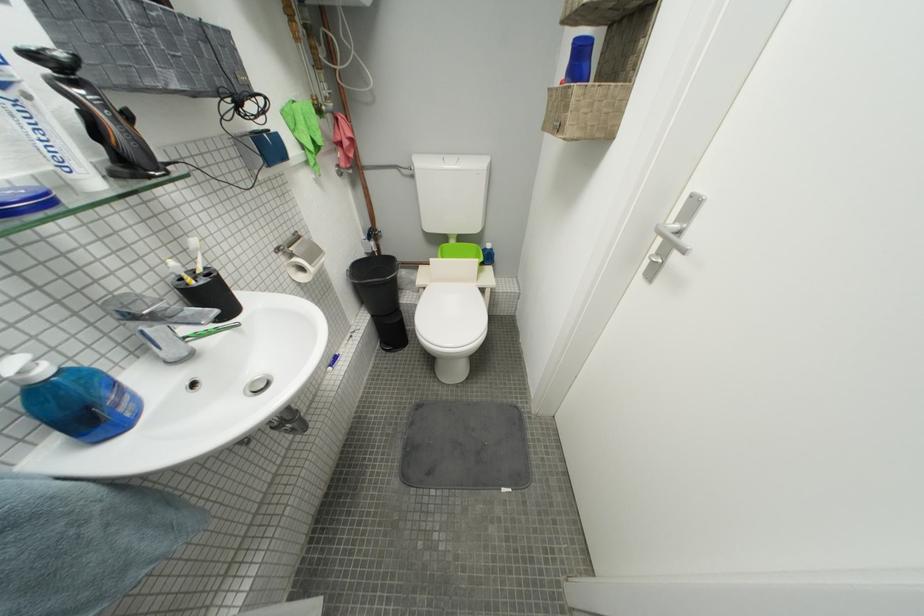
At what (x,y) coordinates should I click in order to perform the action: click on toilet flush button. Please return your answer as a coordinate pair (x, y). The width and height of the screenshot is (924, 616). Looking at the image, I should click on (251, 246).